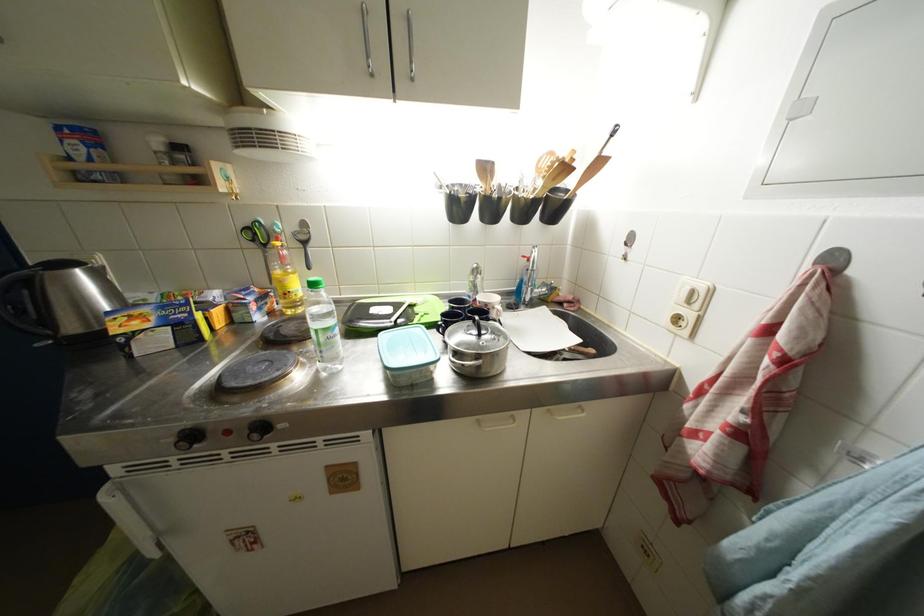
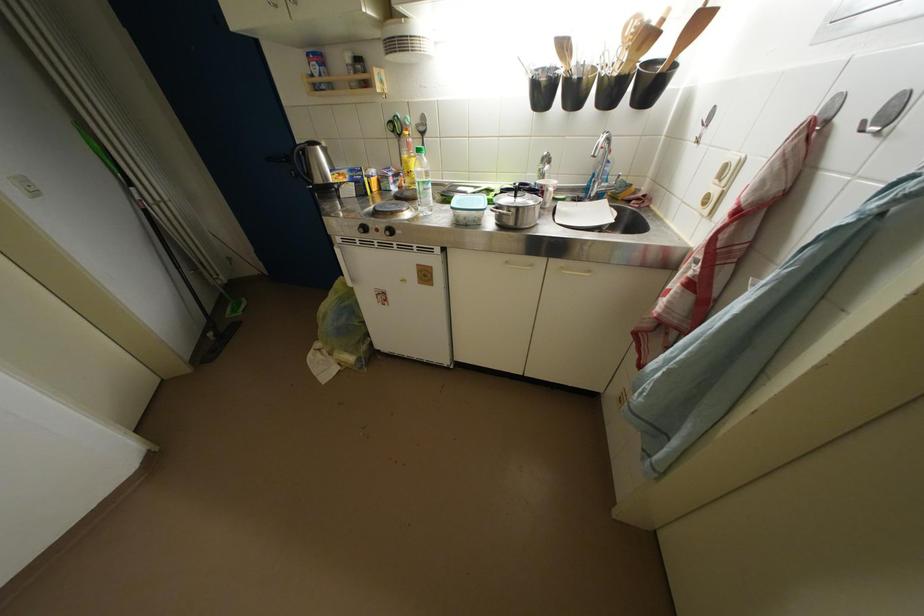
In the second image, find the point that corresponds to [480,274] in the first image.

(551, 161)